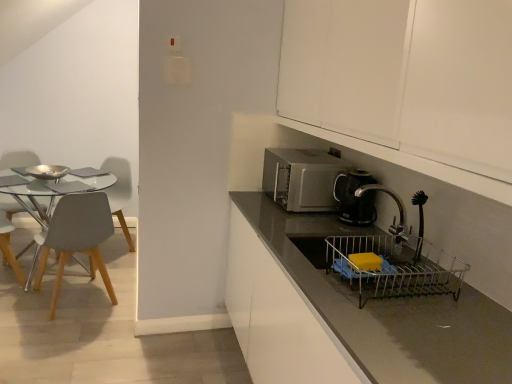
Locate an element on the screen. This screenshot has height=384, width=512. free space above satin silver microwave at center (from a real-world perspective) is located at coordinates (301, 156).